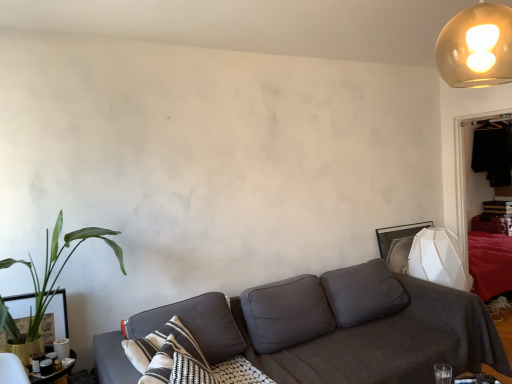
Question: Is white matte geometric lampshade at right in front of or behind dark gray fabric pillow at center in the image?

Choices:
 (A) front
 (B) behind

Answer: (B)

Question: From a real-world perspective, is white matte geometric lampshade at right positioned above or below dark gray fabric pillow at center?

Choices:
 (A) below
 (B) above

Answer: (B)

Question: Which object is the farthest from the white matte geometric lampshade at right?

Choices:
 (A) dark gray fabric couch at center
 (B) wooden textured table at lower left
 (C) translucent glass globe at upper right
 (D) green leafy plant at left
 (E) dark brown wooden dresser at right

Answer: (B)

Question: Estimate the real-world distances between objects in this image. Which object is farther from the wooden textured table at lower left?

Choices:
 (A) white matte geometric lampshade at right
 (B) translucent glass globe at upper right
 (C) dark gray fabric pillow at center
 (D) green leafy plant at left
 (E) dark gray fabric couch at center

Answer: (B)